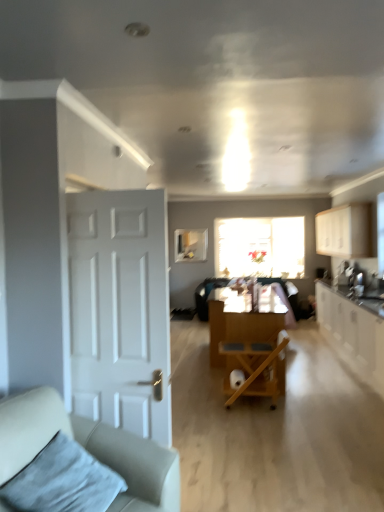
Question: Considering the relative sizes of velvety gray pillow at lower left and wooden folding chair at center in the image provided, is velvety gray pillow at lower left taller than wooden folding chair at center?

Choices:
 (A) no
 (B) yes

Answer: (A)

Question: Is velvety gray pillow at lower left aimed at wooden folding chair at center?

Choices:
 (A) yes
 (B) no

Answer: (B)

Question: From the image's perspective, is velvety gray pillow at lower left over wooden folding chair at center?

Choices:
 (A) yes
 (B) no

Answer: (A)

Question: Is velvety gray pillow at lower left in front of wooden folding chair at center?

Choices:
 (A) yes
 (B) no

Answer: (A)

Question: Considering the relative sizes of velvety gray pillow at lower left and wooden folding chair at center in the image provided, is velvety gray pillow at lower left wider than wooden folding chair at center?

Choices:
 (A) yes
 (B) no

Answer: (A)

Question: Considering the relative sizes of velvety gray pillow at lower left and wooden folding chair at center in the image provided, is velvety gray pillow at lower left thinner than wooden folding chair at center?

Choices:
 (A) no
 (B) yes

Answer: (A)

Question: Is translucent glass window at center outside of white glossy cabinets at right, placed as the second cabinetry when sorted from top to bottom?

Choices:
 (A) no
 (B) yes

Answer: (B)

Question: Does translucent glass window at center lie in front of white glossy cabinets at right, placed as the second cabinetry when sorted from top to bottom?

Choices:
 (A) yes
 (B) no

Answer: (B)

Question: Is translucent glass window at center taller than white glossy cabinets at right, placed as the second cabinetry when sorted from top to bottom?

Choices:
 (A) no
 (B) yes

Answer: (B)

Question: From the image's perspective, is translucent glass window at center over white glossy cabinets at right, which is counted as the 1th cabinetry, starting from the bottom?

Choices:
 (A) no
 (B) yes

Answer: (B)

Question: From the image's perspective, would you say translucent glass window at center is shown under white glossy cabinets at right, which is counted as the 1th cabinetry, starting from the bottom?

Choices:
 (A) yes
 (B) no

Answer: (B)

Question: Considering the relative positions of translucent glass window at center and white glossy cabinets at right, which is counted as the 1th cabinetry, starting from the bottom, in the image provided, is translucent glass window at center to the left of white glossy cabinets at right, which is counted as the 1th cabinetry, starting from the bottom, from the viewer's perspective?

Choices:
 (A) yes
 (B) no

Answer: (A)

Question: Is wooden folding chair at center not inside white glossy cabinets at right, which is counted as the 1th cabinetry, starting from the bottom?

Choices:
 (A) yes
 (B) no

Answer: (A)